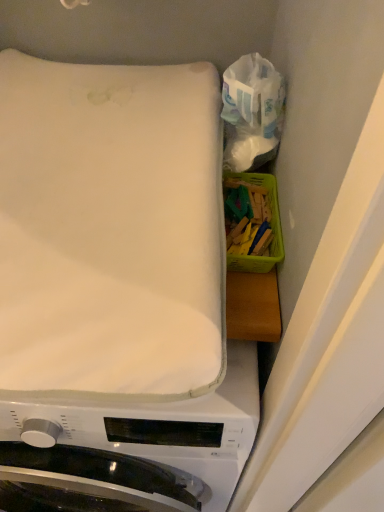
Question: Is white soft mattress at upper left thinner than white fabric at upper left?

Choices:
 (A) no
 (B) yes

Answer: (A)

Question: Considering the relative sizes of white soft mattress at upper left and white fabric at upper left in the image provided, is white soft mattress at upper left smaller than white fabric at upper left?

Choices:
 (A) yes
 (B) no

Answer: (A)

Question: Is white soft mattress at upper left shorter than white fabric at upper left?

Choices:
 (A) no
 (B) yes

Answer: (B)

Question: From a real-world perspective, is white soft mattress at upper left physically below white fabric at upper left?

Choices:
 (A) yes
 (B) no

Answer: (B)

Question: From the image's perspective, is white soft mattress at upper left below white fabric at upper left?

Choices:
 (A) no
 (B) yes

Answer: (A)

Question: Based on their positions, is translucent plastic bag at upper right located to the left or right of white fabric at upper left?

Choices:
 (A) right
 (B) left

Answer: (A)

Question: Considering their positions, is translucent plastic bag at upper right located in front of or behind white fabric at upper left?

Choices:
 (A) front
 (B) behind

Answer: (B)

Question: Is point (226, 89) positioned closer to the camera than point (36, 478)?

Choices:
 (A) farther
 (B) closer

Answer: (B)

Question: Considering the positions of translucent plastic bag at upper right and white fabric at upper left in the image, is translucent plastic bag at upper right bigger or smaller than white fabric at upper left?

Choices:
 (A) big
 (B) small

Answer: (B)

Question: Is white fabric at upper left taller or shorter than translucent plastic bag at upper right?

Choices:
 (A) tall
 (B) short

Answer: (A)

Question: Does point (66, 464) appear closer or farther from the camera than point (279, 130)?

Choices:
 (A) closer
 (B) farther

Answer: (A)

Question: Is white fabric at upper left inside the boundaries of translucent plastic bag at upper right, or outside?

Choices:
 (A) outside
 (B) inside

Answer: (A)

Question: Considering the positions of white fabric at upper left and translucent plastic bag at upper right in the image, is white fabric at upper left bigger or smaller than translucent plastic bag at upper right?

Choices:
 (A) big
 (B) small

Answer: (A)

Question: Is translucent plastic bag at upper right in front of or behind white soft mattress at upper left in the image?

Choices:
 (A) behind
 (B) front

Answer: (A)

Question: Is translucent plastic bag at upper right bigger or smaller than white soft mattress at upper left?

Choices:
 (A) small
 (B) big

Answer: (A)